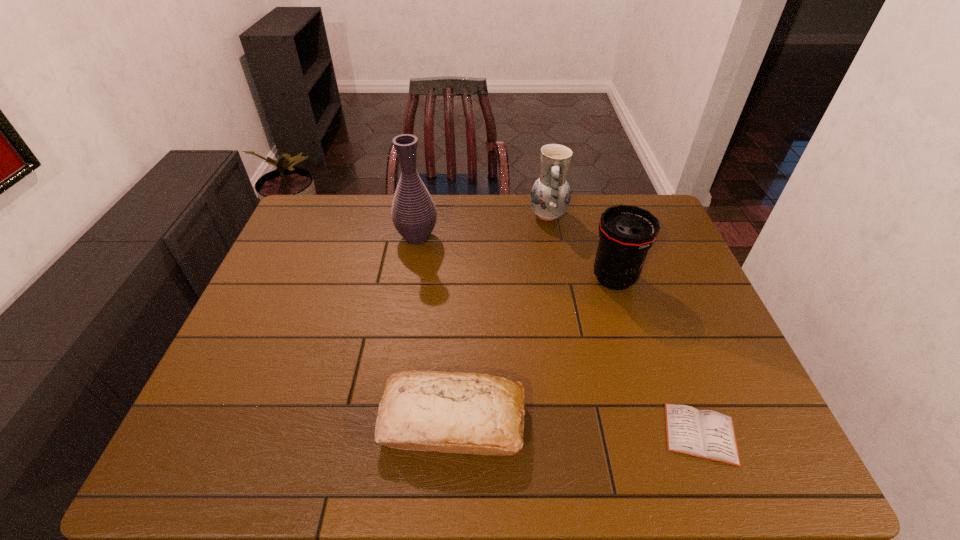
The height and width of the screenshot is (540, 960). Find the location of `vacant space that satisfies the following two spatial constraints: 1. on either side of the pottery; 2. on the left side of the diary`. vacant space that satisfies the following two spatial constraints: 1. on either side of the pottery; 2. on the left side of the diary is located at coordinates (588, 434).

Where is `free space that satisfies the following two spatial constraints: 1. on the front side of the third farthest object; 2. on the right side of the diary`? The height and width of the screenshot is (540, 960). free space that satisfies the following two spatial constraints: 1. on the front side of the third farthest object; 2. on the right side of the diary is located at coordinates (663, 434).